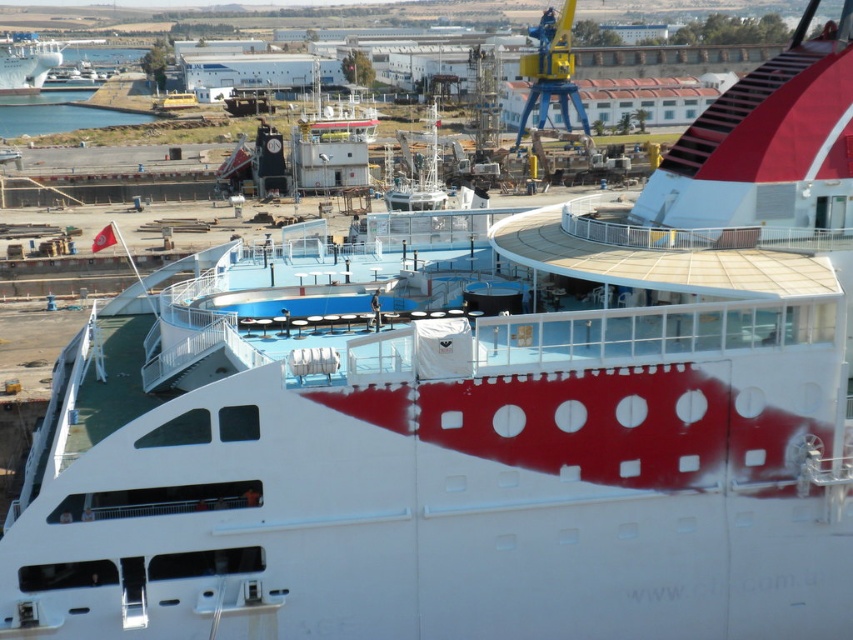
You are standing on the dock and see the blue water at lower left and the white glossy ship at upper left. Which object is positioned higher from the ground?

The white glossy ship at upper left is positioned higher from the ground than the blue water at lower left.

You are a photographer positioned at the shipyard and want to capture a photo of the blue water at lower left and the white glossy ship at upper left. Based on their positions, which object will appear closer to the camera in the final photo?

The blue water at lower left is in front of the white glossy ship at upper left, so it will appear closer to the camera in the photo.